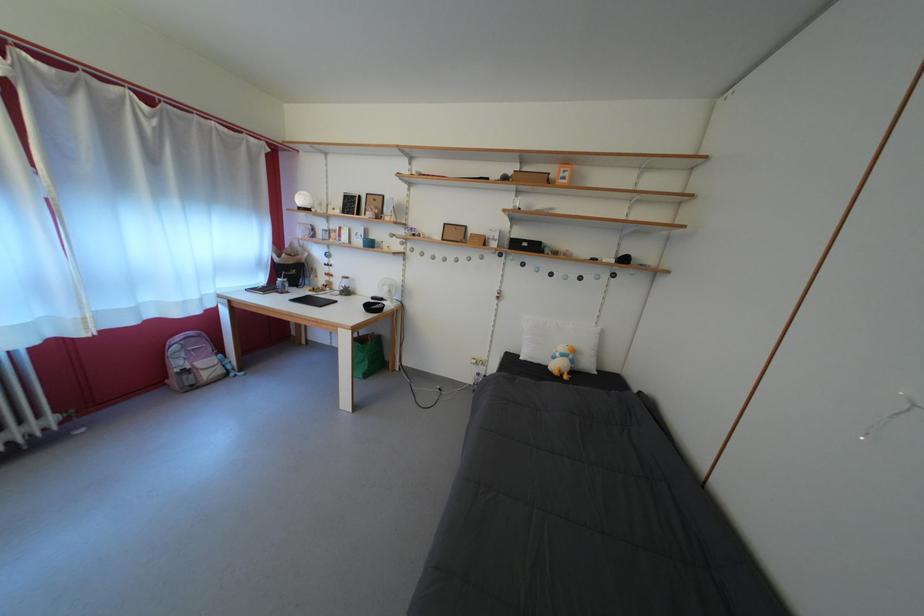
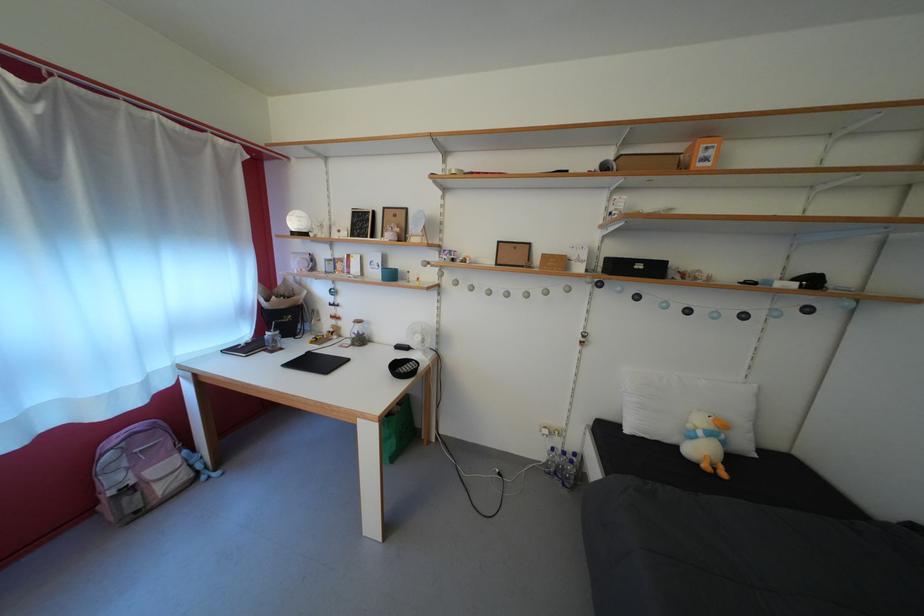
Locate, in the second image, the point that corresponds to (395,294) in the first image.

(427, 344)